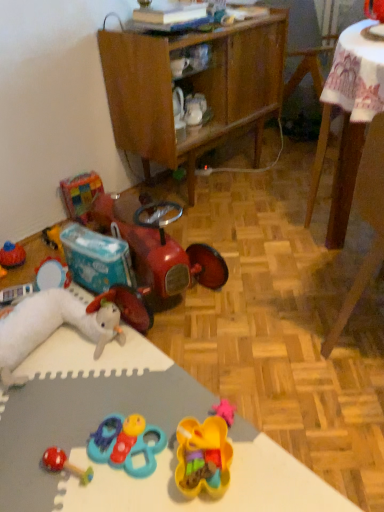
Identify the location of vacant space to the right of rubberized red car at lower left, placed as the fourth toy when sorted from right to left. This screenshot has width=384, height=512. (256, 262).